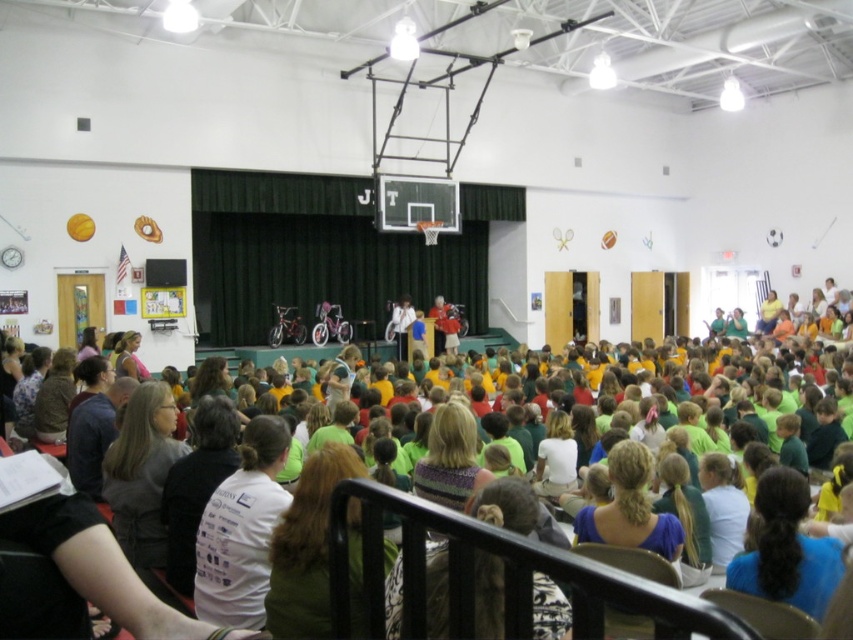
You are standing at the back of the gymnasium and want to take a photo of both points mentioned. Since you can only focus on one point clearly at a time, which point should you focus on to ensure it is closer to your camera? The points are located at coordinates point (144, 465) and point (762, 509).

You should focus on point (144, 465) because it is closer to your camera than point (762, 509).